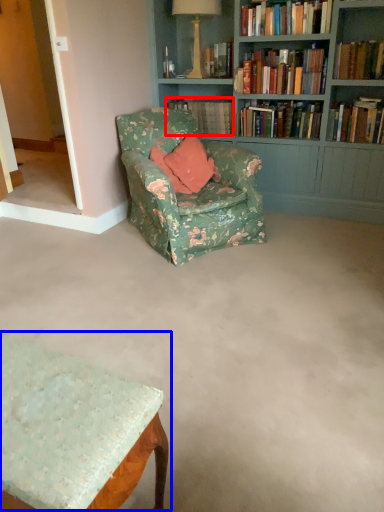
Question: Which object is closer to the camera taking this photo, book (highlighted by a red box) or table (highlighted by a blue box)?

Choices:
 (A) book
 (B) table

Answer: (B)